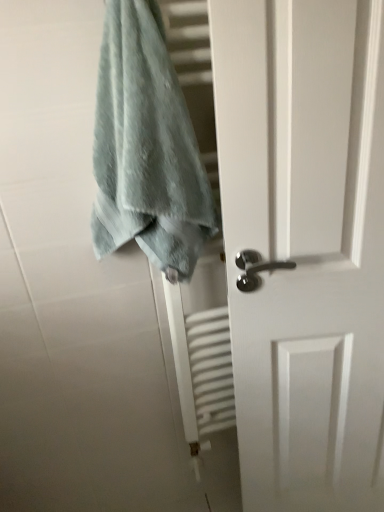
Question: Is white matte door at center completely or partially outside of soft blue towel at upper left?

Choices:
 (A) yes
 (B) no

Answer: (A)

Question: From the image's perspective, is white matte door at center above soft blue towel at upper left?

Choices:
 (A) yes
 (B) no

Answer: (B)

Question: Does white matte door at center have a lesser width compared to soft blue towel at upper left?

Choices:
 (A) no
 (B) yes

Answer: (B)

Question: Considering the relative sizes of white matte door at center and soft blue towel at upper left in the image provided, is white matte door at center bigger than soft blue towel at upper left?

Choices:
 (A) yes
 (B) no

Answer: (A)

Question: Is the depth of white matte door at center greater than that of soft blue towel at upper left?

Choices:
 (A) no
 (B) yes

Answer: (B)

Question: Does white matte door at center turn towards soft blue towel at upper left?

Choices:
 (A) yes
 (B) no

Answer: (B)

Question: From the image's perspective, would you say soft blue towel at upper left is positioned over white matte door at center?

Choices:
 (A) yes
 (B) no

Answer: (A)

Question: Is soft blue towel at upper left positioned in front of white matte door at center?

Choices:
 (A) no
 (B) yes

Answer: (B)

Question: Are soft blue towel at upper left and white matte door at center far apart?

Choices:
 (A) no
 (B) yes

Answer: (A)

Question: Is soft blue towel at upper left facing towards white matte door at center?

Choices:
 (A) yes
 (B) no

Answer: (B)

Question: Is white matte door at center surrounded by soft blue towel at upper left?

Choices:
 (A) yes
 (B) no

Answer: (B)

Question: From a real-world perspective, is soft blue towel at upper left on white matte door at center?

Choices:
 (A) no
 (B) yes

Answer: (B)

Question: From the image's perspective, is soft blue towel at upper left above or below white matte door at center?

Choices:
 (A) below
 (B) above

Answer: (B)